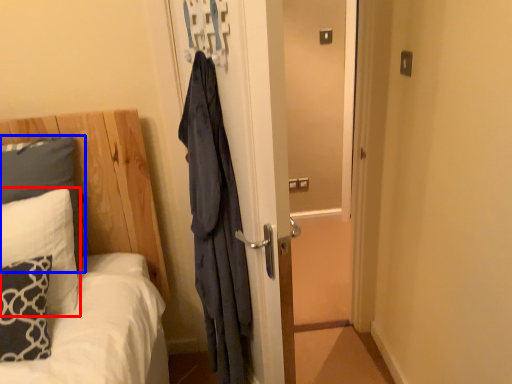
Question: Which point is further to the camera, pillow (highlighted by a red box) or pillow (highlighted by a blue box)?

Choices:
 (A) pillow
 (B) pillow

Answer: (B)